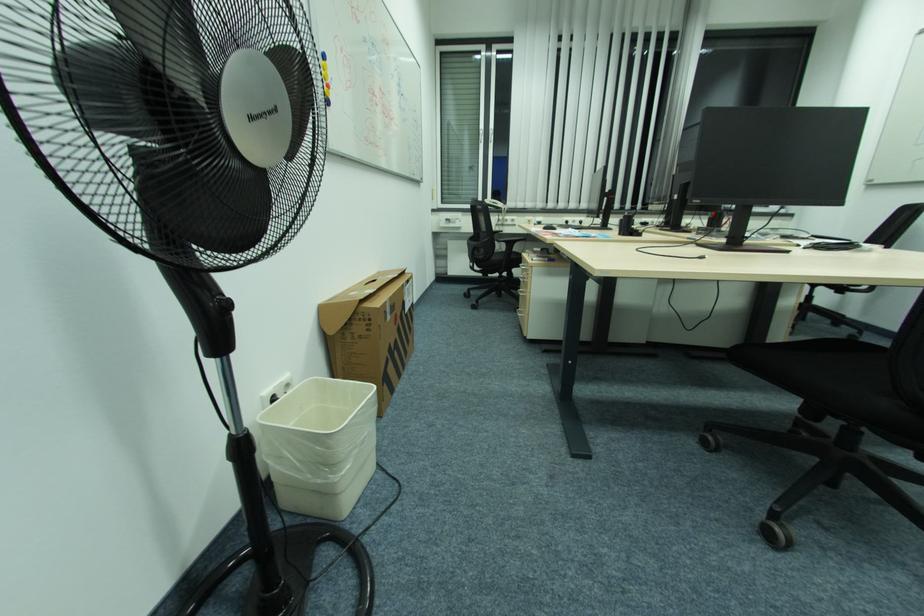
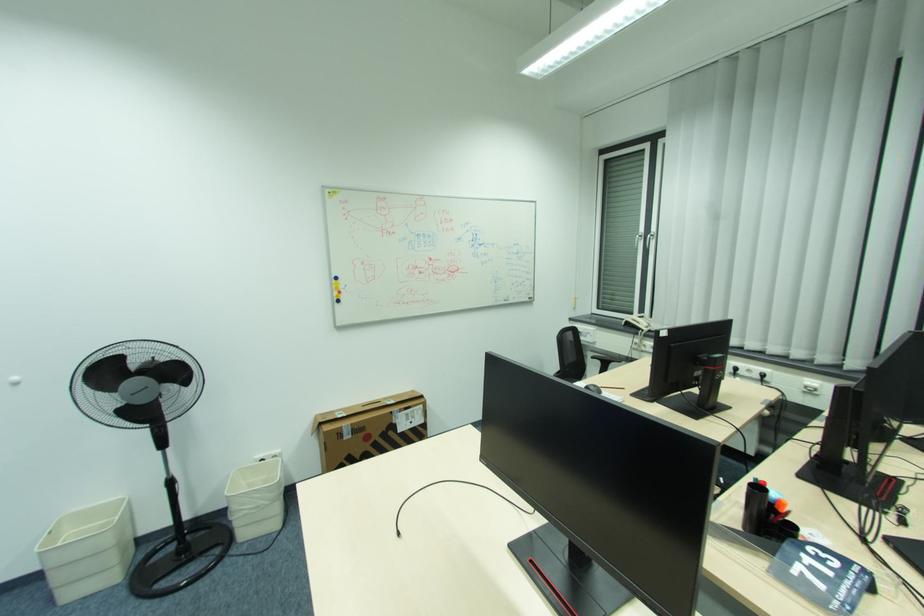
Where in the second image is the point corresponding to (497,132) from the first image?

(653, 236)